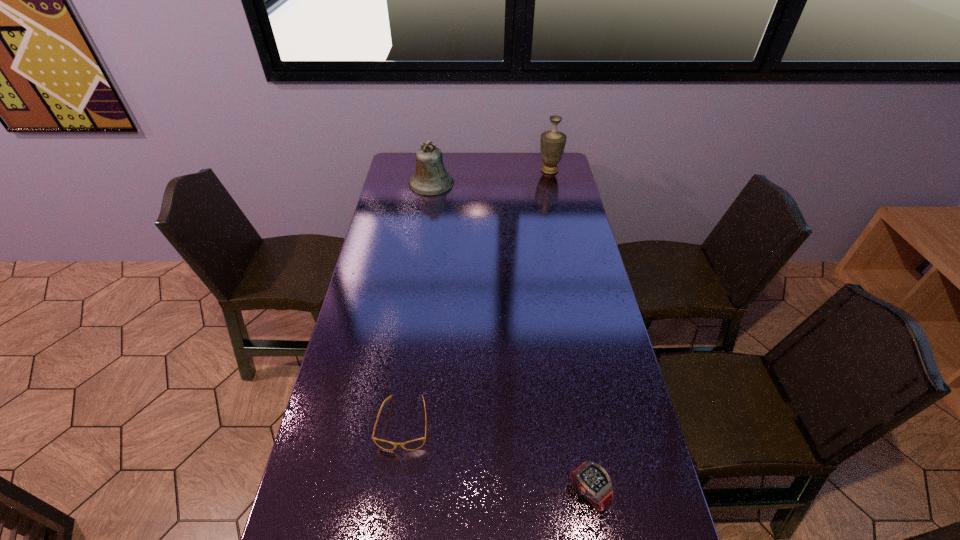
Find the location of `the tallest object`. the tallest object is located at coordinates (552, 143).

This screenshot has height=540, width=960. Find the location of `the third shortest object`. the third shortest object is located at coordinates (430, 178).

Image resolution: width=960 pixels, height=540 pixels. In order to click on watch in this screenshot , I will do `click(590, 480)`.

At what (x,y) coordinates should I click in order to perform the action: click on the third tallest object. Please return your answer as a coordinate pair (x, y). This screenshot has width=960, height=540. Looking at the image, I should click on (590, 480).

The image size is (960, 540). I want to click on the shortest object, so click(415, 444).

Find the location of a particular element. This screenshot has width=960, height=540. sunglasses is located at coordinates (415, 444).

Locate an element on the screen. The width and height of the screenshot is (960, 540). free space located 0.210m on the left of the urn is located at coordinates (492, 170).

At what (x,y) coordinates should I click in order to perform the action: click on vacant point located 0.300m on the front of the second tallest object. Please return your answer as a coordinate pair (x, y). Looking at the image, I should click on (423, 240).

Find the location of a particular element. The height and width of the screenshot is (540, 960). vacant space located on the left of the third tallest object is located at coordinates (549, 493).

Where is `free point located on the front-facing side of the shortest object`? The height and width of the screenshot is (540, 960). free point located on the front-facing side of the shortest object is located at coordinates (394, 498).